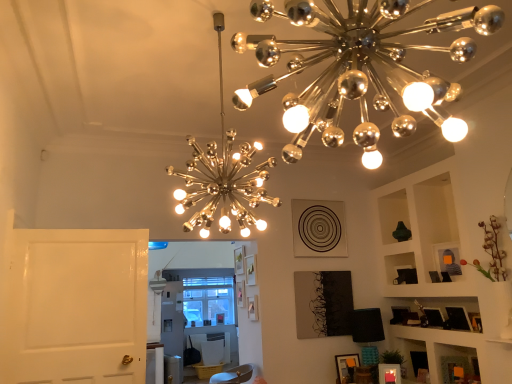
The image size is (512, 384). Find the location of `metallic silver chandelier at upper center, positioned as the 3th lamp in right-to-left order`. metallic silver chandelier at upper center, positioned as the 3th lamp in right-to-left order is located at coordinates (223, 176).

What is the approximate width of metallic silver chandelier at upper center, which appears as the second lamp when ordered from the bottom?

metallic silver chandelier at upper center, which appears as the second lamp when ordered from the bottom, is 23.37 inches in width.

This screenshot has height=384, width=512. Describe the element at coordinates (367, 325) in the screenshot. I see `black fabric lampshade at lower right, the third lamp positioned from the top` at that location.

What do you see at coordinates (253, 308) in the screenshot? The image size is (512, 384). I see `wooden picture frame at center, which appears as the 2th picture frame when ordered from the bottom` at bounding box center [253, 308].

From the picture: In order to face matte black frame at lower right, should I rotate leftwards or rightwards?

You should rotate right by 25.249 degrees.

What is the approximate width of metallic chandelier at upper center, which ranks as the 2th lamp in right-to-left order?

The width of metallic chandelier at upper center, which ranks as the 2th lamp in right-to-left order, is 20.91 inches.

The height and width of the screenshot is (384, 512). Describe the element at coordinates (360, 69) in the screenshot. I see `metallic chandelier at upper center, which ranks as the 3th lamp in bottom-to-top order` at that location.

You are a GUI agent. You are given a task and a screenshot of the screen. Output one action in this format:
    pyautogui.click(x=<x>, y=<y>)
    Task: Click on the metallic silver chandelier at upper center, positioned as the 2th lamp in front-to-back order
    
    Given the screenshot: What is the action you would take?
    pyautogui.click(x=223, y=176)

Is metallic silver chandelier at upper center, the second lamp when ordered from back to front, taller than white glossy door at left?

Yes, metallic silver chandelier at upper center, the second lamp when ordered from back to front, is taller than white glossy door at left.

Locate an element on the screen. The width and height of the screenshot is (512, 384). the 1st lamp in front of the white glossy door at left is located at coordinates (223, 176).

Is metallic silver chandelier at upper center, the second lamp when ordered from back to front, touching white glossy door at left?

metallic silver chandelier at upper center, the second lamp when ordered from back to front, and white glossy door at left are clearly separated.

Which is in front, metallic silver chandelier at upper center, positioned as the 3th lamp in right-to-left order, or white glossy door at left?

Positioned in front is metallic silver chandelier at upper center, positioned as the 3th lamp in right-to-left order.

Between wooden picture frame at center, which ranks as the second picture frame in right-to-left order, and metallic chandelier at upper center, which ranks as the 3th lamp in bottom-to-top order, which one has smaller size?

With smaller size is wooden picture frame at center, which ranks as the second picture frame in right-to-left order.

Is wooden picture frame at center, positioned as the 2th picture frame in front-to-back order, further to the viewer compared to metallic chandelier at upper center, which ranks as the 3th lamp in bottom-to-top order?

Yes, wooden picture frame at center, positioned as the 2th picture frame in front-to-back order, is further from the viewer.

Does wooden picture frame at center, the first picture frame in the top-to-bottom sequence, contain metallic chandelier at upper center, which ranks as the 2th lamp in right-to-left order?

That's incorrect, metallic chandelier at upper center, which ranks as the 2th lamp in right-to-left order, is not inside wooden picture frame at center, the first picture frame in the top-to-bottom sequence.

Is wooden picture frame at center, the 1th picture frame viewed from the left, to the left of metallic chandelier at upper center, which ranks as the 2th lamp in right-to-left order, from the viewer's perspective?

Yes.

Considering the positions of objects wooden picture frame at center, the first picture frame in the top-to-bottom sequence, and wooden picture frame at lower right, acting as the first picture frame starting from the front, in the image provided, who is more to the right, wooden picture frame at center, the first picture frame in the top-to-bottom sequence, or wooden picture frame at lower right, acting as the first picture frame starting from the front,?

wooden picture frame at lower right, acting as the first picture frame starting from the front.

Which object is wider, wooden picture frame at center, positioned as the 2th picture frame in front-to-back order, or wooden picture frame at lower right, acting as the first picture frame starting from the front?

wooden picture frame at lower right, acting as the first picture frame starting from the front, is wider.

Can you confirm if wooden picture frame at center, which appears as the 2th picture frame when ordered from the bottom, is shorter than wooden picture frame at lower right, the second picture frame viewed from the left?

Indeed, wooden picture frame at center, which appears as the 2th picture frame when ordered from the bottom, has a lesser height compared to wooden picture frame at lower right, the second picture frame viewed from the left.

Is wooden picture frame at center, positioned as the 2th picture frame in front-to-back order, positioned beyond the bounds of wooden picture frame at lower right, the second picture frame viewed from the left?

Indeed, wooden picture frame at center, positioned as the 2th picture frame in front-to-back order, is completely outside wooden picture frame at lower right, the second picture frame viewed from the left.

How different are the orientations of metallic chandelier at upper center, the first lamp when ordered from top to bottom, and matte black frame at lower right in degrees?

139 degrees.

Is metallic chandelier at upper center, which appears as the first lamp when viewed from the front, facing away from matte black frame at lower right?

No.

Is metallic chandelier at upper center, which appears as the first lamp when viewed from the front, to the right of matte black frame at lower right from the viewer's perspective?

In fact, metallic chandelier at upper center, which appears as the first lamp when viewed from the front, is to the left of matte black frame at lower right.

Can you confirm if metallic chandelier at upper center, which appears as the first lamp when viewed from the front, is wider than matte black frame at lower right?

Indeed, metallic chandelier at upper center, which appears as the first lamp when viewed from the front, has a greater width compared to matte black frame at lower right.

Can you tell me how much metallic chandelier at upper center, which is the second lamp in left-to-right order, and black fabric lampshade at lower right, which appears as the first lamp when viewed from the right, differ in facing direction?

94.2 degrees.

How far apart are metallic chandelier at upper center, the first lamp when ordered from top to bottom, and black fabric lampshade at lower right, the third lamp positioned from the top?

metallic chandelier at upper center, the first lamp when ordered from top to bottom, is 11.30 feet from black fabric lampshade at lower right, the third lamp positioned from the top.

From the image's perspective, which lamp is the 2nd one above the black fabric lampshade at lower right, the 1th lamp in the bottom-to-top sequence? Please provide its 2D coordinates.

[(360, 69)]

Is metallic chandelier at upper center, which is the second lamp in left-to-right order, aimed at black fabric lampshade at lower right, acting as the 1th lamp starting from the back?

No, metallic chandelier at upper center, which is the second lamp in left-to-right order, is not turned towards black fabric lampshade at lower right, acting as the 1th lamp starting from the back.

Considering the positions of points (221, 63) and (376, 319), is point (221, 63) farther from camera compared to point (376, 319)?

No, it is not.

Does metallic silver chandelier at upper center, positioned as the 3th lamp in right-to-left order, lie behind black fabric lampshade at lower right, acting as the 1th lamp starting from the back?

No, metallic silver chandelier at upper center, positioned as the 3th lamp in right-to-left order, is closer to the camera.

Is metallic silver chandelier at upper center, which is the first lamp in left-to-right order, located outside black fabric lampshade at lower right, placed as the third lamp when sorted from front to back?

That's correct, metallic silver chandelier at upper center, which is the first lamp in left-to-right order, is outside of black fabric lampshade at lower right, placed as the third lamp when sorted from front to back.

Can wooden picture frame at lower right, marked as the first picture frame in a bottom-to-top arrangement, be found inside metallic chandelier at upper center, the first lamp when ordered from top to bottom?

No, wooden picture frame at lower right, marked as the first picture frame in a bottom-to-top arrangement, is not inside metallic chandelier at upper center, the first lamp when ordered from top to bottom.

Could you tell me if metallic chandelier at upper center, which is the second lamp in left-to-right order, is facing wooden picture frame at lower right, placed as the second picture frame when sorted from top to bottom?

No, metallic chandelier at upper center, which is the second lamp in left-to-right order, is not facing towards wooden picture frame at lower right, placed as the second picture frame when sorted from top to bottom.

From a real-world perspective, is metallic chandelier at upper center, the first lamp when ordered from top to bottom, on wooden picture frame at lower right, placed as the second picture frame when sorted from top to bottom?

Yes, from a real-world perspective, metallic chandelier at upper center, the first lamp when ordered from top to bottom, is on top of wooden picture frame at lower right, placed as the second picture frame when sorted from top to bottom.

Which picture frame is the 1st one when counting from the back of the metallic chandelier at upper center, which ranks as the 2th lamp in right-to-left order? Please provide its 2D coordinates.

[(346, 366)]

The width and height of the screenshot is (512, 384). Find the location of `door located underneath the metallic silver chandelier at upper center, which is the first lamp in left-to-right order (from a real-world perspective)`. door located underneath the metallic silver chandelier at upper center, which is the first lamp in left-to-right order (from a real-world perspective) is located at coordinates (76, 306).

From the image's perspective, count 2nd lamps upward from the wooden picture frame at center, which appears as the 2th picture frame when ordered from the bottom, and point to it. Please provide its 2D coordinates.

[(360, 69)]

Based on their spatial positions, is black fabric lampshade at lower right, placed as the 3th lamp when sorted from left to right, or white glossy door at left further from metallic chandelier at upper center, which ranks as the 2th lamp in right-to-left order?

Based on the image, black fabric lampshade at lower right, placed as the 3th lamp when sorted from left to right, appears to be further to metallic chandelier at upper center, which ranks as the 2th lamp in right-to-left order.

From the picture: Which object lies nearer to the anchor point wooden picture frame at center, the first picture frame in the top-to-bottom sequence, white glossy door at left or metallic chandelier at upper center, the first lamp when ordered from top to bottom?

Among the two, white glossy door at left is located nearer to wooden picture frame at center, the first picture frame in the top-to-bottom sequence.

Considering their positions, is metallic chandelier at upper center, the first lamp when ordered from top to bottom, positioned further to white glossy door at left than black fabric lampshade at lower right, the third lamp positioned from the top?

black fabric lampshade at lower right, the third lamp positioned from the top, is positioned further to the anchor white glossy door at left.

Estimate the real-world distances between objects in this image. Which object is closer to matte black frame at lower right, metallic silver chandelier at upper center, positioned as the 3th lamp in right-to-left order, or black fabric lampshade at lower right, the third lamp positioned from the top?

The object closer to matte black frame at lower right is black fabric lampshade at lower right, the third lamp positioned from the top.

Considering their positions, is wooden picture frame at lower right, acting as the first picture frame starting from the front, positioned closer to wooden picture frame at center, positioned as the 2th picture frame in front-to-back order, than metallic chandelier at upper center, which is the second lamp in left-to-right order?

wooden picture frame at lower right, acting as the first picture frame starting from the front, is positioned closer to the anchor wooden picture frame at center, positioned as the 2th picture frame in front-to-back order.

When comparing their distances from metallic chandelier at upper center, the first lamp when ordered from top to bottom, does white glossy door at left or matte black frame at lower right seem further?

Based on the image, matte black frame at lower right appears to be further to metallic chandelier at upper center, the first lamp when ordered from top to bottom.

When comparing their distances from wooden picture frame at lower right, the second picture frame viewed from the left, does metallic chandelier at upper center, acting as the third lamp starting from the back, or black fabric lampshade at lower right, placed as the 3th lamp when sorted from left to right, seem closer?

The object closer to wooden picture frame at lower right, the second picture frame viewed from the left, is black fabric lampshade at lower right, placed as the 3th lamp when sorted from left to right.

From the image, which object appears to be nearer to metallic chandelier at upper center, which ranks as the 2th lamp in right-to-left order, matte black frame at lower right or metallic silver chandelier at upper center, positioned as the 2th lamp in front-to-back order?

Based on the image, metallic silver chandelier at upper center, positioned as the 2th lamp in front-to-back order, appears to be nearer to metallic chandelier at upper center, which ranks as the 2th lamp in right-to-left order.

Locate an element on the screen. The width and height of the screenshot is (512, 384). shelf between metallic silver chandelier at upper center, positioned as the 3th lamp in right-to-left order, and wooden picture frame at lower right, placed as the 2th picture frame when sorted from back to front, in the front-back direction is located at coordinates tap(449, 359).

Locate an element on the screen. door between metallic chandelier at upper center, which appears as the first lamp when viewed from the front, and matte black frame at lower right, along the z-axis is located at coordinates (76, 306).

Where is `shelf positioned between metallic silver chandelier at upper center, which is counted as the 2th lamp, starting from the top, and wooden picture frame at center, the first picture frame in the top-to-bottom sequence, from near to far`? The width and height of the screenshot is (512, 384). shelf positioned between metallic silver chandelier at upper center, which is counted as the 2th lamp, starting from the top, and wooden picture frame at center, the first picture frame in the top-to-bottom sequence, from near to far is located at coordinates (449, 359).

Where is `lamp positioned between metallic chandelier at upper center, which is the second lamp in left-to-right order, and black fabric lampshade at lower right, the 1th lamp in the bottom-to-top sequence, from near to far`? Image resolution: width=512 pixels, height=384 pixels. lamp positioned between metallic chandelier at upper center, which is the second lamp in left-to-right order, and black fabric lampshade at lower right, the 1th lamp in the bottom-to-top sequence, from near to far is located at coordinates (223, 176).